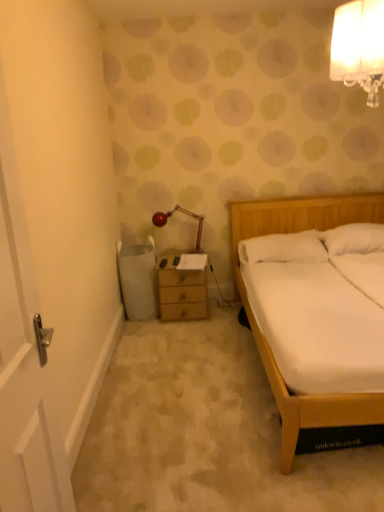
Question: Looking at the image, does white soft pillow at right, marked as the 1th pillow in a left-to-right arrangement, seem bigger or smaller compared to white glass lampshade at upper right, acting as the 2th lamp starting from the left?

Choices:
 (A) big
 (B) small

Answer: (B)

Question: From a real-world perspective, is white soft pillow at right, marked as the 1th pillow in a left-to-right arrangement, above or below white glass lampshade at upper right, marked as the second lamp in a back-to-front arrangement?

Choices:
 (A) below
 (B) above

Answer: (A)

Question: Based on their relative distances, which object is nearer to the metallic red lamp at upper center, which is the 2th lamp from top to bottom?

Choices:
 (A) white plastic trash bin at left
 (B) white soft pillow at right, marked as the 1th pillow in a left-to-right arrangement
 (C) white wooden door at left
 (D) white glass lampshade at upper right, marked as the second lamp in a back-to-front arrangement
 (E) wooden chest of drawers at center

Answer: (E)

Question: Considering the real-world distances, which object is farthest from the white soft pillow at upper right, the 2th pillow when ordered from left to right?

Choices:
 (A) white plastic trash bin at left
 (B) metallic red lamp at upper center, which ranks as the 1th lamp in bottom-to-top order
 (C) white wooden door at left
 (D) wooden chest of drawers at center
 (E) white glass lampshade at upper right, which is the 1th lamp from front to back

Answer: (C)